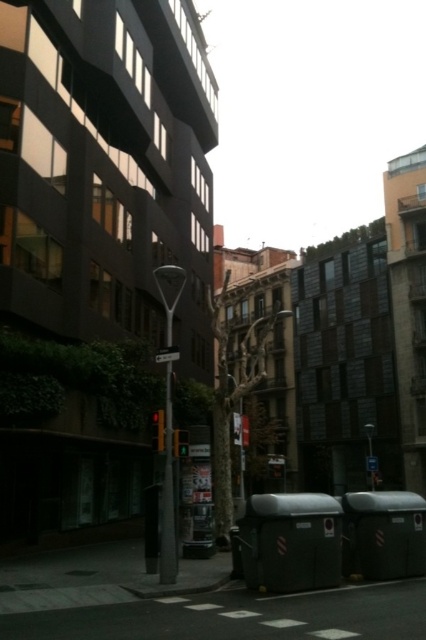
Is point (169, 314) less distant than point (164, 353)?

No, (169, 314) is further to viewer.

Which is more to the left, metallic streetlight at center or white plastic street sign at center?

Positioned to the left is metallic streetlight at center.

The width and height of the screenshot is (426, 640). Identify the location of metallic streetlight at center. 167,493.

Find the location of a particular element. metallic streetlight at center is located at coordinates (167, 493).

Is point (238, 353) farther from viewer compared to point (172, 486)?

That is True.

Is brown textured tree at center to the left of metallic streetlight at center from the viewer's perspective?

No, brown textured tree at center is not to the left of metallic streetlight at center.

Between point (233, 356) and point (164, 433), which one is positioned in front?

Point (164, 433) is in front.

Identify the location of brown textured tree at center. The image size is (426, 640). (235, 381).

From the picture: Can you confirm if brown textured tree at center is positioned to the left of white plastic street sign at center?

Incorrect, brown textured tree at center is not on the left side of white plastic street sign at center.

Is point (230, 317) positioned behind point (166, 360)?

Yes, point (230, 317) is behind point (166, 360).

Which is in front, point (218, 365) or point (169, 348)?

Positioned in front is point (169, 348).

At what (x,y) coordinates should I click in order to perform the action: click on brown textured tree at center. Please return your answer as a coordinate pair (x, y). The image size is (426, 640). Looking at the image, I should click on (235, 381).